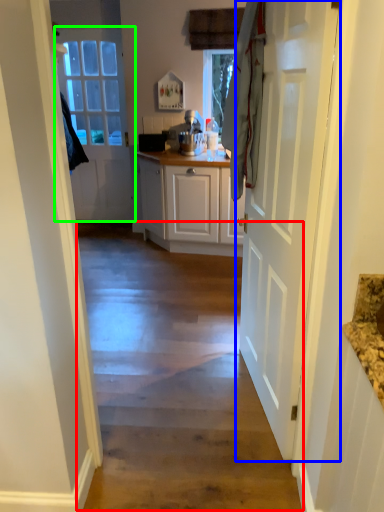
Question: Based on their relative distances, which object is nearer to path (highlighted by a red box)? Choose from door (highlighted by a blue box) and door (highlighted by a green box).

Choices:
 (A) door
 (B) door

Answer: (A)